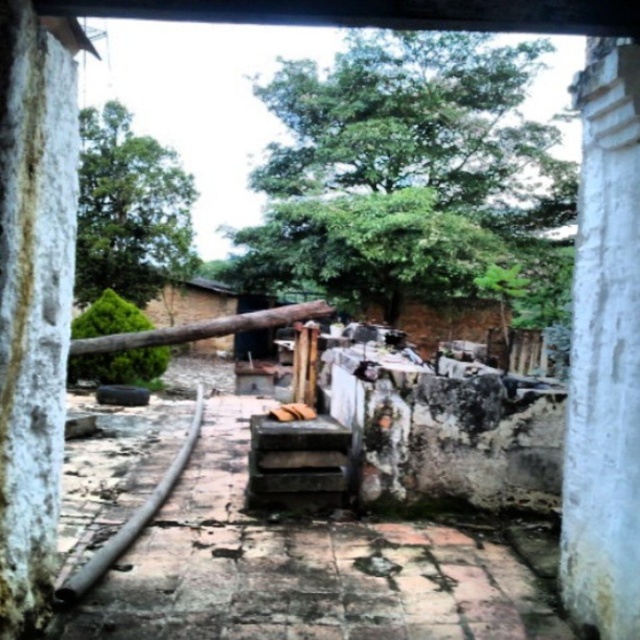
Question: Is white rough stone pillar at left wider than white rough stone pillar at center?

Choices:
 (A) yes
 (B) no

Answer: (B)

Question: Can you confirm if white rough stone pillar at left is positioned above white rough stone pillar at center?

Choices:
 (A) yes
 (B) no

Answer: (B)

Question: Which object appears closest to the camera in this image?

Choices:
 (A) white rough stone pillar at left
 (B) concrete block at center

Answer: (A)

Question: Which point is farther to the camera?

Choices:
 (A) (595, 301)
 (B) (262, 566)

Answer: (B)

Question: Which of the following is the closest to the observer?

Choices:
 (A) concrete block at center
 (B) white rough stone pillar at center
 (C) white rough stone pillar at left

Answer: (C)

Question: Is white rough stone pillar at left thinner than white rough stone pillar at center?

Choices:
 (A) yes
 (B) no

Answer: (A)